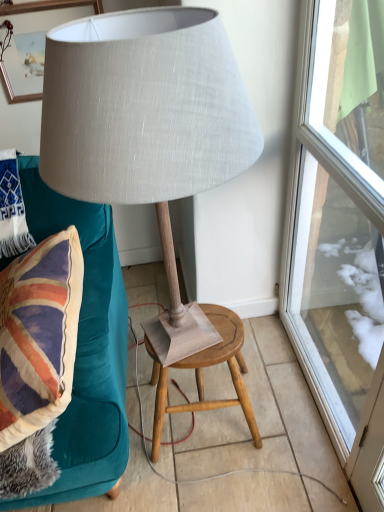
Question: Looking at their shapes, would you say matte gray fabric lamp at center is wider or thinner than wooden stool at center?

Choices:
 (A) wide
 (B) thin

Answer: (A)

Question: Based on their sizes in the image, would you say matte gray fabric lamp at center is bigger or smaller than wooden stool at center?

Choices:
 (A) big
 (B) small

Answer: (A)

Question: Estimate the real-world distances between objects in this image. Which object is closer to the white woven pillow at upper left?

Choices:
 (A) matte gray fabric lamp at center
 (B) wooden stool at center
 (C) velvet teal sofa at left
 (D) matte wooden picture frame at upper left
 (E) transparent glass door at right

Answer: (C)

Question: Which object is the farthest from the matte wooden picture frame at upper left?

Choices:
 (A) white woven pillow at upper left
 (B) wooden stool at center
 (C) matte gray fabric lamp at center
 (D) velvet teal sofa at left
 (E) transparent glass door at right

Answer: (B)